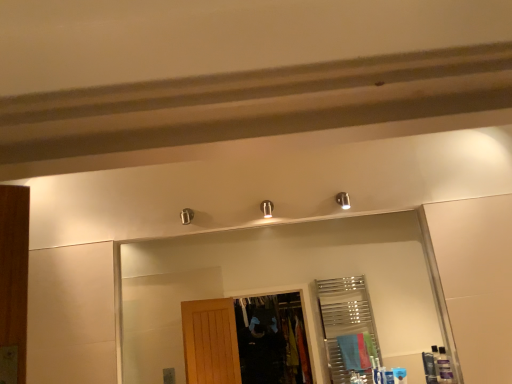
Question: Could you tell me if matte black toiletry at lower right, arranged as the 2th toiletry when viewed from the right, is facing blue plastic toiletry at lower right, the 1th toiletry viewed from the left?

Choices:
 (A) yes
 (B) no

Answer: (B)

Question: Does matte black toiletry at lower right, which is the second toiletry from left to right, lie behind blue plastic toiletry at lower right, arranged as the third toiletry when viewed from the right?

Choices:
 (A) no
 (B) yes

Answer: (B)

Question: Is matte black toiletry at lower right, arranged as the 2th toiletry when viewed from the right, positioned far away from blue plastic toiletry at lower right, arranged as the third toiletry when viewed from the right?

Choices:
 (A) no
 (B) yes

Answer: (A)

Question: Considering the relative sizes of matte black toiletry at lower right, which is the second toiletry from left to right, and blue plastic toiletry at lower right, arranged as the third toiletry when viewed from the right, in the image provided, is matte black toiletry at lower right, which is the second toiletry from left to right, shorter than blue plastic toiletry at lower right, arranged as the third toiletry when viewed from the right,?

Choices:
 (A) no
 (B) yes

Answer: (A)

Question: Is matte black toiletry at lower right, which is the second toiletry from left to right, outside of blue plastic toiletry at lower right, the 1th toiletry viewed from the left?

Choices:
 (A) yes
 (B) no

Answer: (A)

Question: Does matte black toiletry at lower right, arranged as the 2th toiletry when viewed from the right, appear on the left side of blue plastic toiletry at lower right, arranged as the third toiletry when viewed from the right?

Choices:
 (A) yes
 (B) no

Answer: (B)

Question: Is clear glass mirror at upper center at the back of matte black toiletry at lower right, arranged as the 2th toiletry when viewed from the right?

Choices:
 (A) no
 (B) yes

Answer: (B)

Question: From the image's perspective, is matte black toiletry at lower right, which is the second toiletry from left to right, located beneath clear glass mirror at upper center?

Choices:
 (A) yes
 (B) no

Answer: (A)

Question: From a real-world perspective, is matte black toiletry at lower right, which is the second toiletry from left to right, on clear glass mirror at upper center?

Choices:
 (A) no
 (B) yes

Answer: (A)

Question: Can you confirm if matte black toiletry at lower right, arranged as the 2th toiletry when viewed from the right, is shorter than clear glass mirror at upper center?

Choices:
 (A) no
 (B) yes

Answer: (B)

Question: Is matte black toiletry at lower right, arranged as the 2th toiletry when viewed from the right, closer to camera compared to clear glass mirror at upper center?

Choices:
 (A) no
 (B) yes

Answer: (A)

Question: Is matte black toiletry at lower right, which is the second toiletry from left to right, smaller than clear glass mirror at upper center?

Choices:
 (A) yes
 (B) no

Answer: (A)

Question: From the image's perspective, is blue plastic toiletry at lower right, arranged as the third toiletry when viewed from the right, below translucent plastic bottles at lower right, the 1th toiletry in the right-to-left sequence?

Choices:
 (A) yes
 (B) no

Answer: (A)